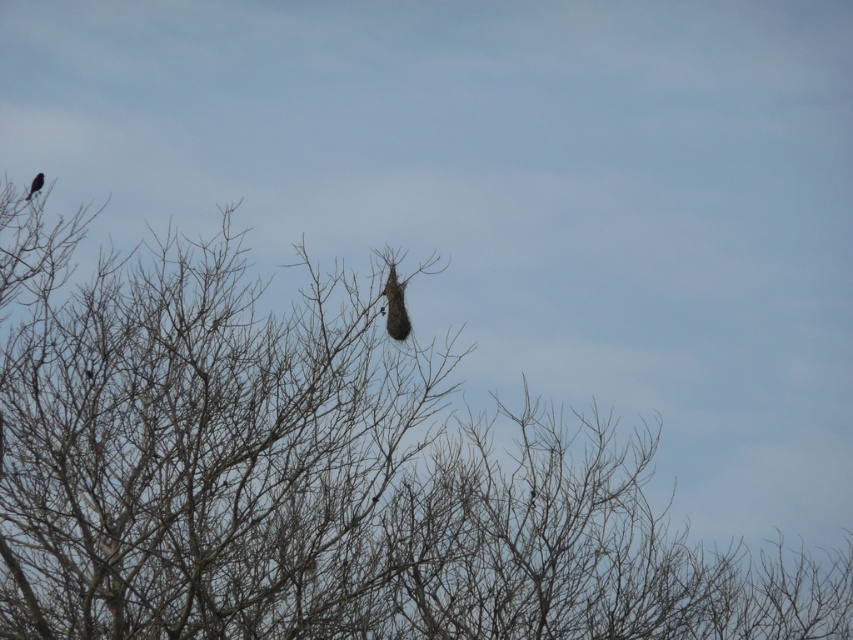
Who is positioned more to the right, brown textured nest at center or silhouette glossy bird at upper left?

Positioned to the right is brown textured nest at center.

Between brown textured nest at center and silhouette glossy bird at upper left, which one has less height?

Standing shorter between the two is silhouette glossy bird at upper left.

Is point (805, 618) closer to viewer compared to point (35, 192)?

Yes, it is.

Identify the location of brown textured nest at center. (317, 476).

Does dark brown feathered bird at center have a lesser width compared to silhouette glossy bird at upper left?

Incorrect, dark brown feathered bird at center's width is not less than silhouette glossy bird at upper left's.

Can you confirm if dark brown feathered bird at center is bigger than silhouette glossy bird at upper left?

Yes, dark brown feathered bird at center is bigger than silhouette glossy bird at upper left.

Where is `dark brown feathered bird at center`? The width and height of the screenshot is (853, 640). dark brown feathered bird at center is located at coordinates (395, 307).

Can you confirm if brown textured nest at center is wider than dark brown feathered bird at center?

Yes.

Locate an element on the screen. This screenshot has height=640, width=853. brown textured nest at center is located at coordinates (317, 476).

I want to click on brown textured nest at center, so click(x=317, y=476).